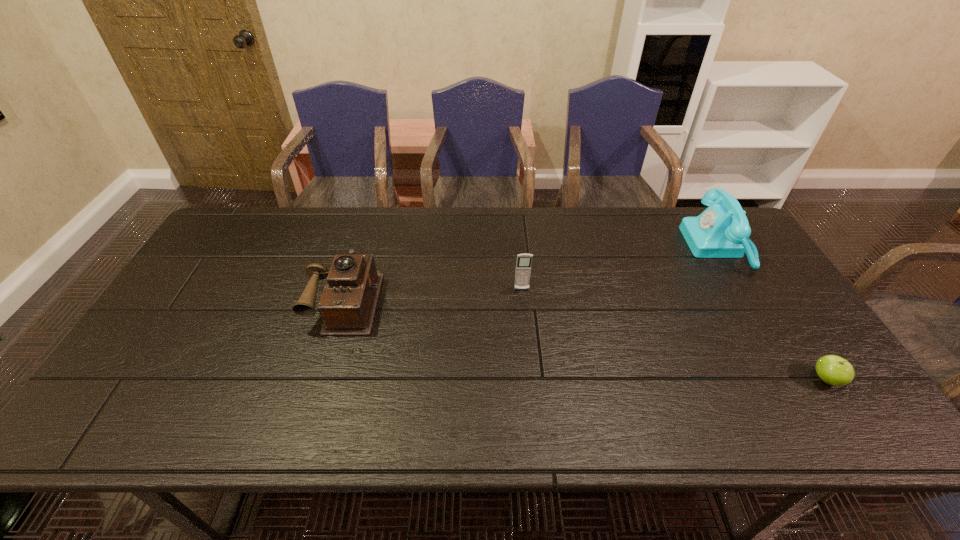
Where is `blank space that satisfies the following two spatial constraints: 1. on the dial of the telephone; 2. on the back side of the shortest object`? blank space that satisfies the following two spatial constraints: 1. on the dial of the telephone; 2. on the back side of the shortest object is located at coordinates (800, 379).

You are a GUI agent. You are given a task and a screenshot of the screen. Output one action in this format:
    pyautogui.click(x=<x>, y=<y>)
    Task: Click on the vacant space that satisfies the following two spatial constraints: 1. on the dial of the telephone; 2. on the front-facing side of the third object from right to left
    The image size is (960, 540).
    Given the screenshot: What is the action you would take?
    pyautogui.click(x=746, y=290)

Where is `free spot that satisfies the following two spatial constraints: 1. on the horn of the shortest object; 2. on the right side of the phonograph_record`? This screenshot has height=540, width=960. free spot that satisfies the following two spatial constraints: 1. on the horn of the shortest object; 2. on the right side of the phonograph_record is located at coordinates (323, 379).

The width and height of the screenshot is (960, 540). Find the location of `free space in the image that satisfies the following two spatial constraints: 1. on the dial of the telephone; 2. on the right side of the shortest object`. free space in the image that satisfies the following two spatial constraints: 1. on the dial of the telephone; 2. on the right side of the shortest object is located at coordinates (800, 379).

In order to click on blank area in the image that satisfies the following two spatial constraints: 1. on the horn of the phonograph_record; 2. on the left side of the nearest object in this screenshot , I will do [323, 379].

This screenshot has height=540, width=960. Identify the location of free space that satisfies the following two spatial constraints: 1. on the front-facing side of the apple; 2. on the left side of the cellular telephone. (530, 379).